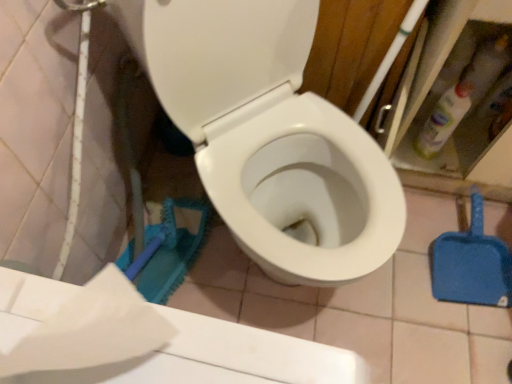
What is the approximate height of white glossy toilet at center?

33.32 inches.

The width and height of the screenshot is (512, 384). Describe the element at coordinates (444, 119) in the screenshot. I see `translucent plastic bottle at upper right` at that location.

Image resolution: width=512 pixels, height=384 pixels. Identify the location of white matte toilet paper at lower left. (80, 327).

Where is `blue plastic shovel at lower right`? blue plastic shovel at lower right is located at coordinates (471, 264).

Are translucent plastic bottle at upper right and blue plastic shovel at lower right located far from each other?

No.

From the image's perspective, which one is positioned higher, translucent plastic bottle at upper right or blue plastic shovel at lower right?

From the image's view, translucent plastic bottle at upper right is above.

Considering the relative sizes of translucent plastic bottle at upper right and blue plastic shovel at lower right in the image provided, is translucent plastic bottle at upper right taller than blue plastic shovel at lower right?

Indeed, translucent plastic bottle at upper right has a greater height compared to blue plastic shovel at lower right.

Is translucent plastic bottle at upper right positioned with its back to blue plastic shovel at lower right?

No, translucent plastic bottle at upper right's orientation is not away from blue plastic shovel at lower right.

Consider the image. Which point is more forward, (460, 283) or (329, 248)?

The point (329, 248) is more forward.

Is blue plastic shovel at lower right to the left of white glossy toilet at center from the viewer's perspective?

In fact, blue plastic shovel at lower right is to the right of white glossy toilet at center.

Is blue plastic shovel at lower right surrounding white glossy toilet at center?

Definitely not — white glossy toilet at center is not inside blue plastic shovel at lower right.

Can you confirm if blue plastic shovel at lower right is bigger than white glossy toilet at center?

Incorrect, blue plastic shovel at lower right is not larger than white glossy toilet at center.

Considering the relative positions of white glossy toilet at center and blue plastic shovel at lower right in the image provided, is white glossy toilet at center behind blue plastic shovel at lower right?

No, it is not.

From a real-world perspective, which is physically below, white glossy toilet at center or blue plastic shovel at lower right?

blue plastic shovel at lower right, from a real-world perspective.

The image size is (512, 384). What are the coordinates of `shovel behind the white glossy toilet at center` in the screenshot? It's located at (471, 264).

Is translucent plastic bottle at upper right facing towards white matte toilet paper at lower left?

No, translucent plastic bottle at upper right is not aimed at white matte toilet paper at lower left.

From a real-world perspective, between translucent plastic bottle at upper right and white matte toilet paper at lower left, who is vertically higher?

white matte toilet paper at lower left.

In the scene shown: Considering the sizes of objects translucent plastic bottle at upper right and white matte toilet paper at lower left in the image provided, who is taller, translucent plastic bottle at upper right or white matte toilet paper at lower left?

With more height is translucent plastic bottle at upper right.

Considering their positions, is translucent plastic bottle at upper right located in front of or behind white glossy toilet at center?

translucent plastic bottle at upper right is positioned farther from the viewer than white glossy toilet at center.

Identify the location of cleaning product on the right side of white glossy toilet at center. (444, 119).

Is point (444, 126) positioned behind point (324, 158)?

Yes, point (444, 126) is farther from viewer.

In the scene shown: From a real-world perspective, is translucent plastic bottle at upper right positioned above or below white glossy toilet at center?

Clearly, from a real-world perspective, translucent plastic bottle at upper right is below white glossy toilet at center.

Considering the positions of points (130, 46) and (39, 348), is point (130, 46) farther from camera compared to point (39, 348)?

Yes.

Is white glossy toilet at center oriented towards white matte toilet paper at lower left?

No, white glossy toilet at center does not turn towards white matte toilet paper at lower left.

Considering the positions of objects white glossy toilet at center and white matte toilet paper at lower left in the image provided, who is more to the left, white glossy toilet at center or white matte toilet paper at lower left?

Positioned to the left is white matte toilet paper at lower left.

Can white matte toilet paper at lower left be found inside white glossy toilet at center?

No, white matte toilet paper at lower left is not a part of white glossy toilet at center.

From a real-world perspective, is white matte toilet paper at lower left physically above blue plastic shovel at lower right?

Yes.

Which is in front, white matte toilet paper at lower left or blue plastic shovel at lower right?

white matte toilet paper at lower left is closer to the camera.

Is white matte toilet paper at lower left facing towards blue plastic shovel at lower right?

No, white matte toilet paper at lower left is not aimed at blue plastic shovel at lower right.

In the scene shown: Can you confirm if white matte toilet paper at lower left is wider than blue plastic shovel at lower right?

No, white matte toilet paper at lower left is not wider than blue plastic shovel at lower right.

Where is `shovel on the right of the translucent plastic bottle at upper right`? This screenshot has width=512, height=384. shovel on the right of the translucent plastic bottle at upper right is located at coordinates (471, 264).

The height and width of the screenshot is (384, 512). Find the location of `toilet in front of the blue plastic shovel at lower right`. toilet in front of the blue plastic shovel at lower right is located at coordinates (269, 135).

From the image, which object appears to be farther from white glossy toilet at center, translucent plastic bottle at upper right or blue plastic shovel at lower right?

Based on the image, blue plastic shovel at lower right appears to be further to white glossy toilet at center.

Considering their positions, is blue plastic shovel at lower right positioned closer to white matte toilet paper at lower left than white glossy toilet at center?

white glossy toilet at center is closer to white matte toilet paper at lower left.

Estimate the real-world distances between objects in this image. Which object is closer to blue plastic shovel at lower right, translucent plastic bottle at upper right or white glossy toilet at center?

translucent plastic bottle at upper right is closer to blue plastic shovel at lower right.

Considering their positions, is white glossy toilet at center positioned closer to white matte toilet paper at lower left than blue plastic shovel at lower right?

The object closer to white matte toilet paper at lower left is white glossy toilet at center.

Estimate the real-world distances between objects in this image. Which object is further from white glossy toilet at center, blue plastic shovel at lower right or translucent plastic bottle at upper right?

The object further to white glossy toilet at center is blue plastic shovel at lower right.

From the image, which object appears to be farther from white glossy toilet at center, white matte toilet paper at lower left or blue plastic shovel at lower right?

white matte toilet paper at lower left lies further to white glossy toilet at center than the other object.

Looking at the image, which one is located further to translucent plastic bottle at upper right, white glossy toilet at center or blue plastic shovel at lower right?

The object further to translucent plastic bottle at upper right is white glossy toilet at center.

From the image, which object appears to be nearer to translucent plastic bottle at upper right, white matte toilet paper at lower left or white glossy toilet at center?

white glossy toilet at center is closer to translucent plastic bottle at upper right.

This screenshot has height=384, width=512. What are the coordinates of `toilet located between white matte toilet paper at lower left and translucent plastic bottle at upper right in the depth direction` in the screenshot? It's located at pos(269,135).

You are a GUI agent. You are given a task and a screenshot of the screen. Output one action in this format:
    pyautogui.click(x=<x>, y=<y>)
    Task: Click on the cleaning product between white matte toilet paper at lower left and blue plastic shovel at lower right from front to back
    
    Given the screenshot: What is the action you would take?
    pyautogui.click(x=444, y=119)

At what (x,y) coordinates should I click in order to perform the action: click on toilet between white matte toilet paper at lower left and blue plastic shovel at lower right along the z-axis. Please return your answer as a coordinate pair (x, y). The height and width of the screenshot is (384, 512). Looking at the image, I should click on (269, 135).

The height and width of the screenshot is (384, 512). In order to click on cleaning product located between white glossy toilet at center and blue plastic shovel at lower right in the depth direction in this screenshot , I will do `click(444, 119)`.